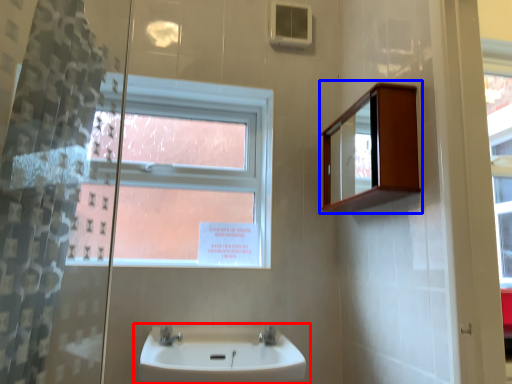
Question: Which point is further to the camera, sink (highlighted by a red box) or medicine cabinet (highlighted by a blue box)?

Choices:
 (A) sink
 (B) medicine cabinet

Answer: (B)